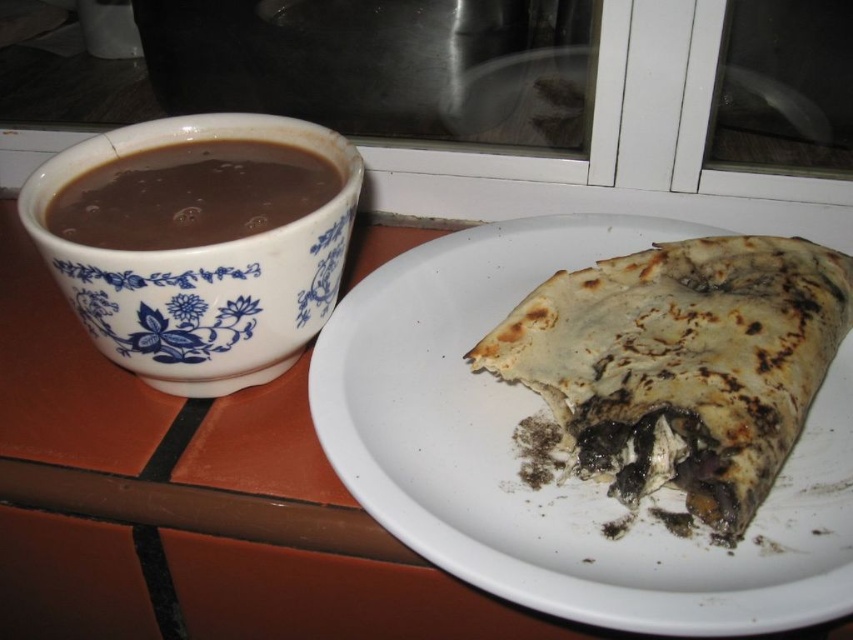
You are a delivery robot with a 36 inch arm. You need to reach the blue porcelain mug at left to pick it up. Can your arm reach it?

The blue porcelain mug at left is 36.51 inches away from the viewer. Since your arm is 36 inches, it is slightly shorter than the required distance, so you cannot reach it.